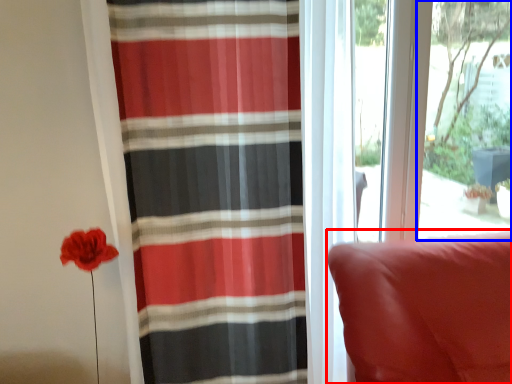
Question: Among these objects, which one is nearest to the camera, furniture (highlighted by a red box) or window screen (highlighted by a blue box)?

Choices:
 (A) furniture
 (B) window screen

Answer: (A)